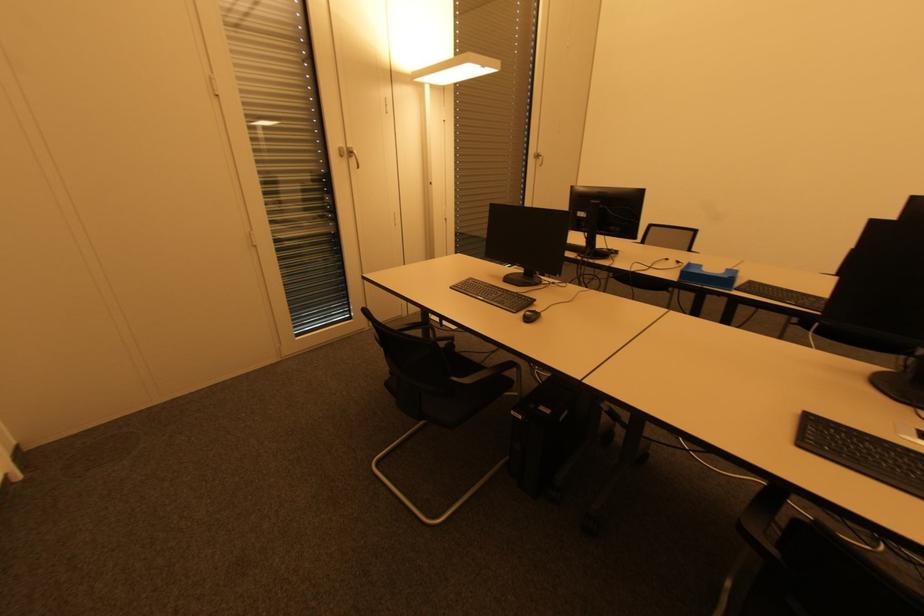
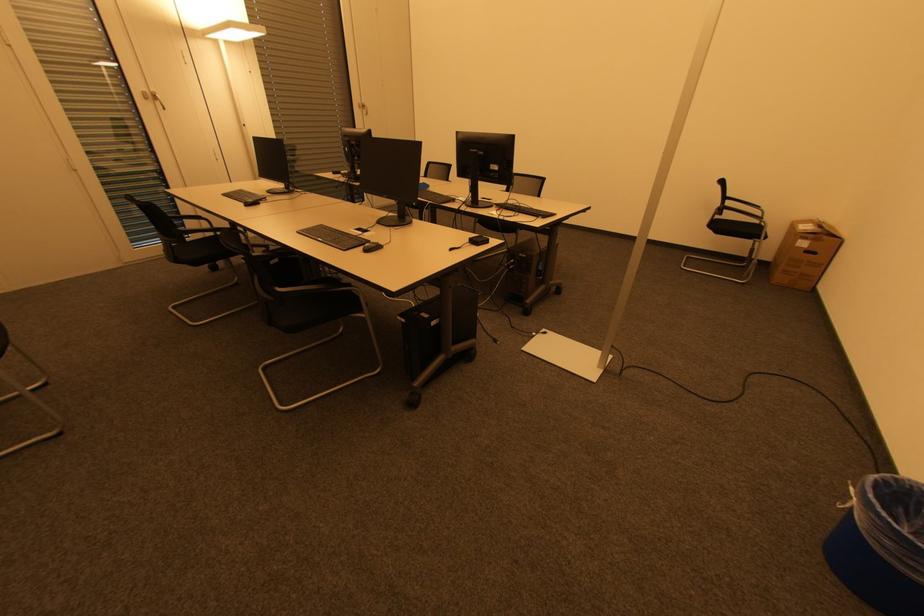
The images are taken continuously from a first-person perspective. In which direction are you moving?

The cameraman walked toward right, backward.